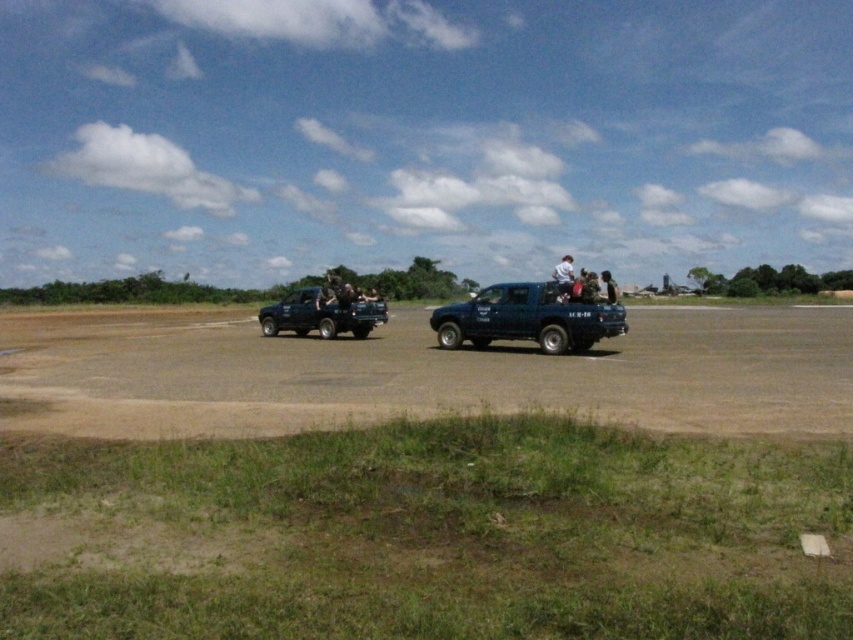
Looking at this image, you are standing at the edge of the field looking at the matte blue truck at center and the white matte shirt at center. Which object appears closer to you?

The white matte shirt at center appears closer because it is larger than the matte blue truck at center, indicating it is nearer to the observer.

You are standing at the edge of the field looking towards the center where both the matte blue truck at center and the white matte shirt at center are located. Which object appears taller from your viewpoint?

The white matte shirt at center appears taller than the matte blue truck at center because the description states that the matte blue truck at center is shorter than the white matte shirt at center.